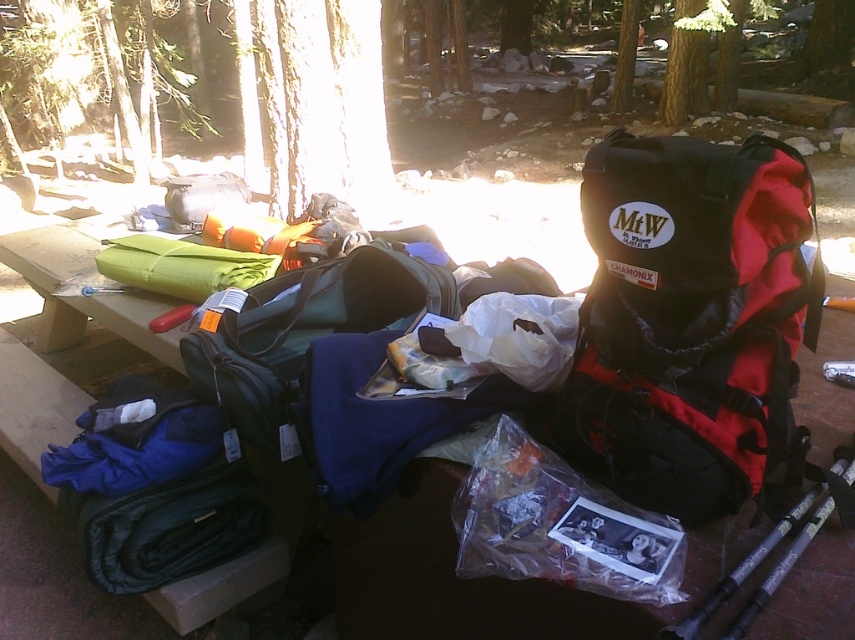
Is translucent plastic bag at center taller than green fabric sleeping bag at center?

No.

Does translucent plastic bag at center have a greater width compared to green fabric sleeping bag at center?

No, translucent plastic bag at center is not wider than green fabric sleeping bag at center.

Describe the element at coordinates (559, 525) in the screenshot. I see `translucent plastic bag at center` at that location.

Locate an element on the screen. The width and height of the screenshot is (855, 640). translucent plastic bag at center is located at coordinates (559, 525).

Looking at this image, who is more forward, (33, 531) or (756, 209)?

Positioned in front is point (756, 209).

Is wooden picnic table at center to the left of black/red nylon backpack at right from the viewer's perspective?

Indeed, wooden picnic table at center is positioned on the left side of black/red nylon backpack at right.

You are a GUI agent. You are given a task and a screenshot of the screen. Output one action in this format:
    pyautogui.click(x=<x>, y=<y>)
    Task: Click on the wooden picnic table at center
    This screenshot has height=640, width=855.
    Given the screenshot: What is the action you would take?
    click(60, 438)

Is wooden picnic table at center in front of green fabric sleeping bag at center?

Yes, it is.

Between wooden picnic table at center and green fabric sleeping bag at center, which one is positioned lower?

wooden picnic table at center

Between point (251, 556) and point (282, 396), which one is positioned in front?

Point (282, 396)

The width and height of the screenshot is (855, 640). I want to click on wooden picnic table at center, so click(60, 438).